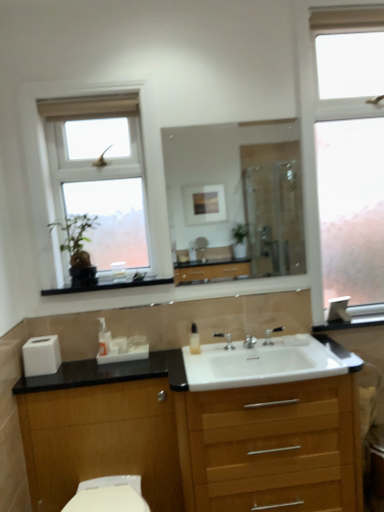
This screenshot has width=384, height=512. I want to click on blank space situated above white glossy toilet bowl at lower left (from a real-world perspective), so [x=105, y=489].